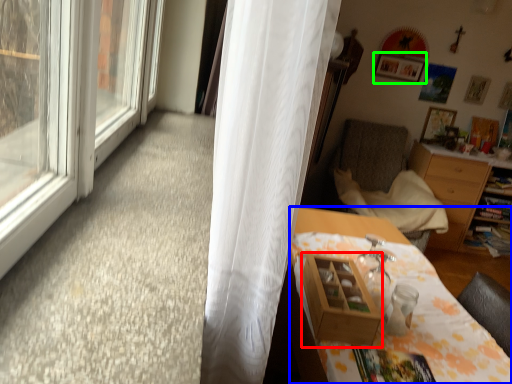
Question: Which object is the farthest from shelf (highlighted by a red box)? Choose among these: desk (highlighted by a blue box) or picture frame (highlighted by a green box).

Choices:
 (A) desk
 (B) picture frame

Answer: (B)